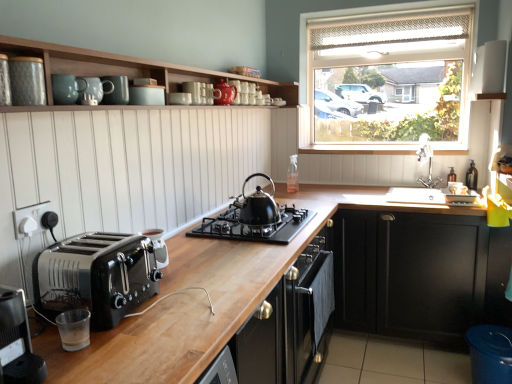
Question: In terms of size, does matte ceramic canister at upper center, which appears as the 4th appliance when viewed from the left, appear bigger or smaller than glossy ceramic mugs at upper center, acting as the 2th appliance starting from the top?

Choices:
 (A) big
 (B) small

Answer: (B)

Question: Is point (159, 97) closer or farther from the camera than point (196, 89)?

Choices:
 (A) closer
 (B) farther

Answer: (A)

Question: Which is farther from the brushed metal knob at lower left, the first knob viewed from the left?

Choices:
 (A) matte ceramic mugs at upper center, the 2th appliance viewed from the left
 (B) teal ceramic mug at upper center
 (C) black plastic toaster at lower left
 (D) white glossy microwave at upper right, the first appliance in the top-to-bottom sequence
 (E) matte ceramic canister at upper left, marked as the 8th appliance in a back-to-front arrangement

Answer: (D)

Question: Considering the real-world distances, which object is closest to the brushed metal knob at lower left, the 2th knob from the right?

Choices:
 (A) wooden at left
 (B) black plastic toaster at lower left
 (C) black matte gas stove at center
 (D) silver metallic faucet at upper right
 (E) matte white bowl at upper center, arranged as the third appliance when viewed from the back

Answer: (B)